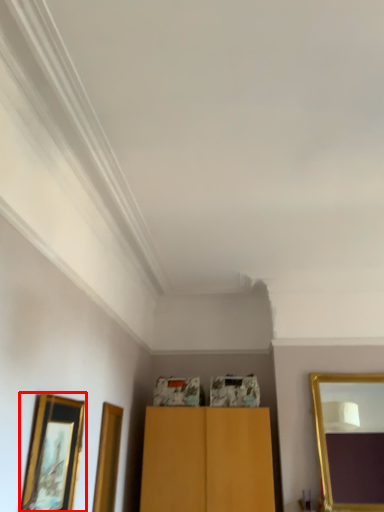
Question: From the image's perspective, where is picture frame (annotated by the red box) located relative to mirror?

Choices:
 (A) above
 (B) below

Answer: (A)